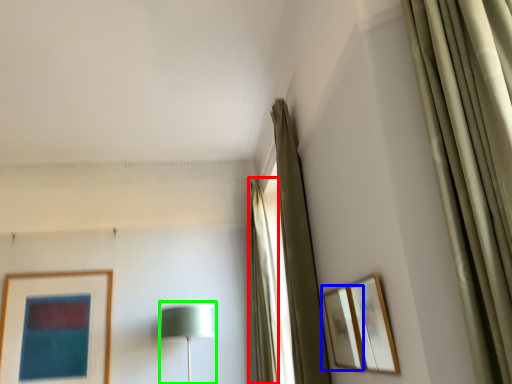
Question: Considering the real-world distances, which object is farthest from curtain (highlighted by a red box)? picture frame (highlighted by a blue box) or table lamp (highlighted by a green box)?

Choices:
 (A) picture frame
 (B) table lamp

Answer: (A)